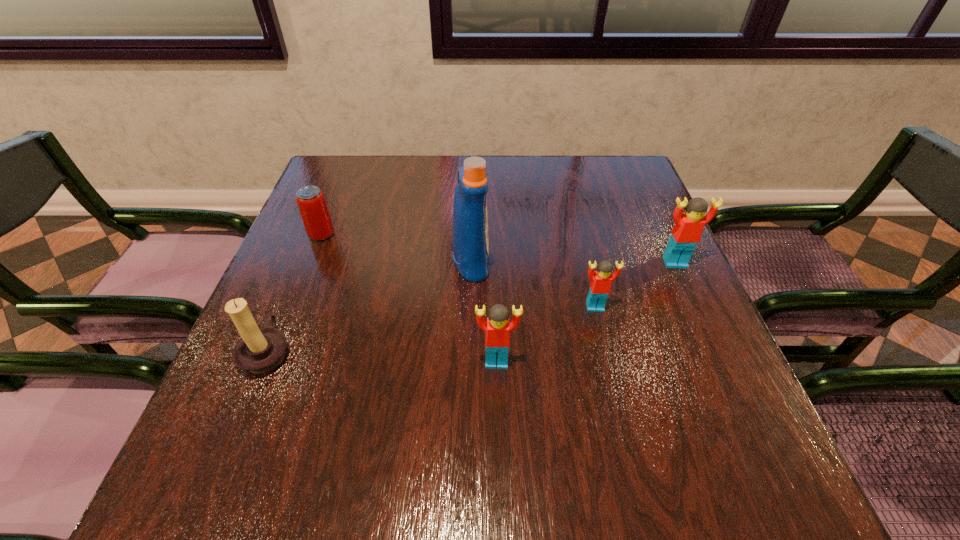
The image size is (960, 540). In order to click on free space between the tallest object and the beer can in this screenshot , I will do `click(396, 248)`.

Find the location of a particular element. Image resolution: width=960 pixels, height=540 pixels. vacant space that's between the rightmost object and the candle holder is located at coordinates 471,307.

The height and width of the screenshot is (540, 960). In order to click on vacant area that lies between the farthest Lego and the beer can in this screenshot , I will do `click(498, 248)`.

You are a GUI agent. You are given a task and a screenshot of the screen. Output one action in this format:
    pyautogui.click(x=<x>, y=<y>)
    Task: Click on the free space between the farthest Lego and the leftmost Lego
    The width and height of the screenshot is (960, 540).
    Given the screenshot: What is the action you would take?
    pyautogui.click(x=586, y=312)

Locate an element on the screen. The width and height of the screenshot is (960, 540). free space between the beer can and the nearest Lego is located at coordinates (409, 298).

You are a GUI agent. You are given a task and a screenshot of the screen. Output one action in this format:
    pyautogui.click(x=<x>, y=<y>)
    Task: Click on the fifth closest object relative to the detergent
    The image size is (960, 540).
    Given the screenshot: What is the action you would take?
    pyautogui.click(x=686, y=233)

Identify the location of object that is the second closest one to the beer can. (470, 243).

Find the location of a particular element. This screenshot has width=960, height=540. Lego that can be found as the closest to the fourth farthest object is located at coordinates (686, 233).

Identify which Lego is located as the third nearest to the detergent. Please provide its 2D coordinates. Your answer should be formatted as a tuple, i.e. [(x, y)], where the tuple contains the x and y coordinates of a point satisfying the conditions above.

[(686, 233)]

I want to click on free space that satisfies the following two spatial constraints: 1. on the face of the farthest Lego; 2. on the wick of the candle holder, so click(x=715, y=351).